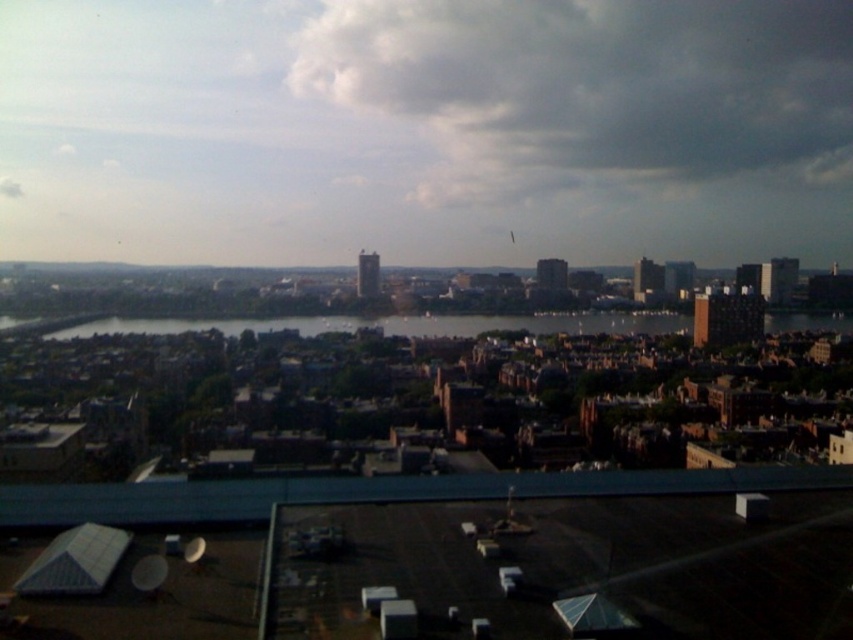
Question: Is white fluffy cloud at upper center wider than dark blue water at center?

Choices:
 (A) no
 (B) yes

Answer: (A)

Question: Among these points, which one is nearest to the camera?

Choices:
 (A) (535, 321)
 (B) (479, 93)

Answer: (A)

Question: Can you confirm if white fluffy cloud at upper center is positioned above dark blue water at center?

Choices:
 (A) no
 (B) yes

Answer: (B)

Question: Is white fluffy cloud at upper center smaller than dark blue water at center?

Choices:
 (A) no
 (B) yes

Answer: (A)

Question: Which object is closer to the camera taking this photo?

Choices:
 (A) white fluffy cloud at upper center
 (B) dark blue water at center

Answer: (B)